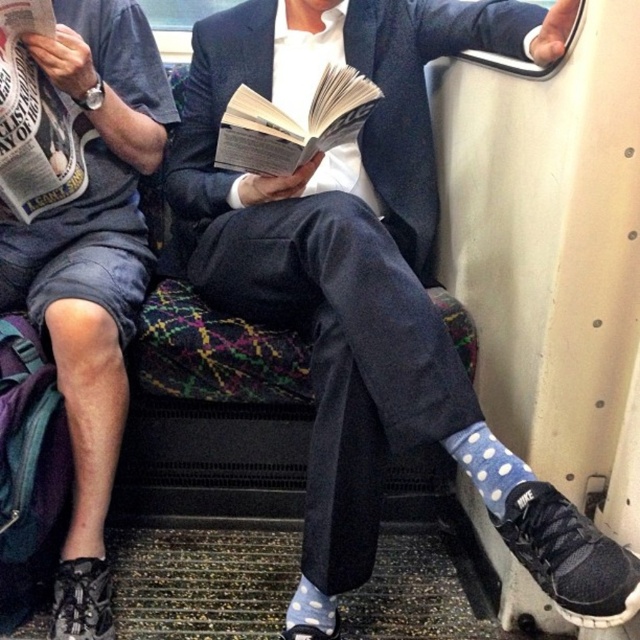
Question: Which of the following is the closest to the observer?

Choices:
 (A) (340, 547)
 (B) (93, 179)

Answer: (A)

Question: Which of the following is the farthest from the observer?

Choices:
 (A) blue polka dot socks at lower center
 (B) matte gray shorts at left

Answer: (B)

Question: From the image, what is the correct spatial relationship of blue polka dot socks at lower center in relation to matte gray shorts at left?

Choices:
 (A) below
 (B) above

Answer: (B)

Question: In this image, where is blue polka dot socks at lower center located relative to matte gray shorts at left?

Choices:
 (A) below
 (B) above

Answer: (B)

Question: From the image, what is the correct spatial relationship of blue polka dot socks at lower center in relation to matte gray shorts at left?

Choices:
 (A) below
 (B) above

Answer: (B)